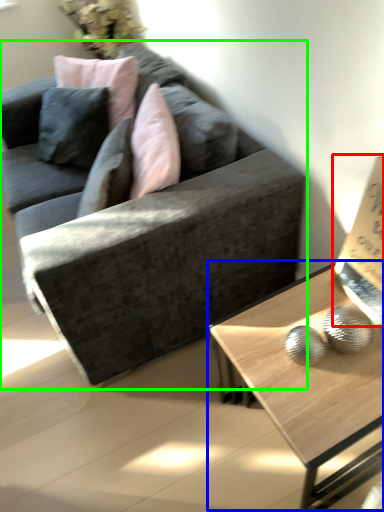
Question: Which object is positioned farthest from paperback book (highlighted by a red box)? Select from coffee table (highlighted by a blue box) and studio couch (highlighted by a green box).

Choices:
 (A) coffee table
 (B) studio couch

Answer: (B)